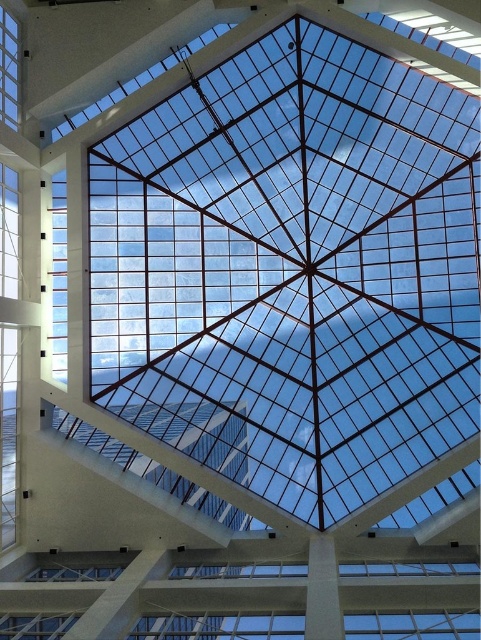
Does transparent glass window at upper center have a lesser width compared to transparent glass window at upper left?

Incorrect, transparent glass window at upper center's width is not less than transparent glass window at upper left's.

This screenshot has height=640, width=481. What are the coordinates of `transparent glass window at upper center` in the screenshot? It's located at (138, 81).

Is point (143, 72) farther from viewer compared to point (3, 36)?

Yes.

This screenshot has width=481, height=640. I want to click on transparent glass window at upper center, so click(138, 81).

Identify the location of clear glass window at left. (59, 276).

Which is more to the right, clear glass window at left or transparent glass window at upper left?

From the viewer's perspective, clear glass window at left appears more on the right side.

What do you see at coordinates (59, 276) in the screenshot?
I see `clear glass window at left` at bounding box center [59, 276].

I want to click on clear glass window at left, so click(59, 276).

Is clear glass window at left closer to camera compared to transparent glass window at upper center?

No.

The width and height of the screenshot is (481, 640). Identify the location of clear glass window at left. (59, 276).